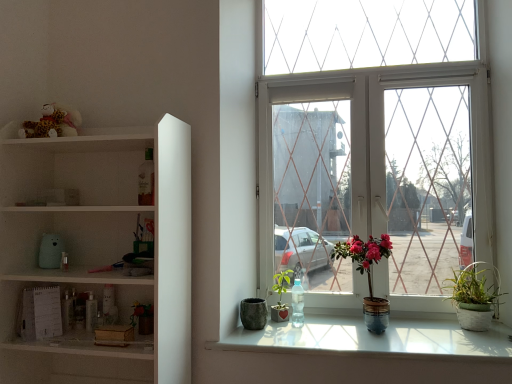
Locate an element on the screen. This screenshot has height=384, width=512. free spot to the left of white woven basket at lower right, which is the 4th houseplant from left to right is located at coordinates (431, 322).